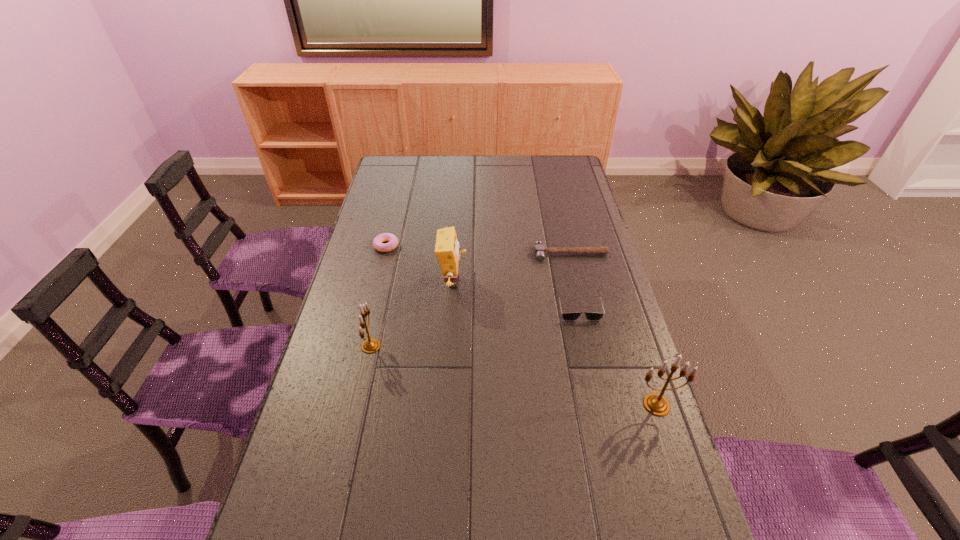
The image size is (960, 540). Find the location of `free point between the sponge and the farther candelabrum`. free point between the sponge and the farther candelabrum is located at coordinates (412, 314).

Locate an element on the screen. This screenshot has width=960, height=540. vacant area between the shorter candelabrum and the fourth object from right to left is located at coordinates (412, 314).

In order to click on empty space that is in between the third object from left to right and the sunglasses in this screenshot , I will do `click(516, 295)`.

Select which object appears as the closest to the doughnut. Please provide its 2D coordinates. Your answer should be formatted as a tuple, i.e. [(x, y)], where the tuple contains the x and y coordinates of a point satisfying the conditions above.

[(447, 252)]

Identify the location of the third closest object to the hammer. (392, 240).

You are a GUI agent. You are given a task and a screenshot of the screen. Output one action in this format:
    pyautogui.click(x=<x>, y=<y>)
    Task: Click on the vacant space that satisfies the following two spatial constraints: 1. on the front-facing side of the sunglasses; 2. on the right side of the taller candelabrum
    This screenshot has height=540, width=960.
    Given the screenshot: What is the action you would take?
    pyautogui.click(x=600, y=404)

I want to click on vacant space that satisfies the following two spatial constraints: 1. on the front-facing side of the taller candelabrum; 2. on the left side of the sunglasses, so click(600, 404).

Image resolution: width=960 pixels, height=540 pixels. Find the location of `vacant space that satisfies the following two spatial constraints: 1. on the striking face of the hammer; 2. on the right side of the nearer candelabrum`. vacant space that satisfies the following two spatial constraints: 1. on the striking face of the hammer; 2. on the right side of the nearer candelabrum is located at coordinates (606, 404).

Where is `free space in the image that satisfies the following two spatial constraints: 1. on the striking face of the taller candelabrum; 2. on the left side of the hammer`? The width and height of the screenshot is (960, 540). free space in the image that satisfies the following two spatial constraints: 1. on the striking face of the taller candelabrum; 2. on the left side of the hammer is located at coordinates (606, 404).

The width and height of the screenshot is (960, 540). Find the location of `free spot that satisfies the following two spatial constraints: 1. on the face of the third object from left to right; 2. on the right side of the right candelabrum`. free spot that satisfies the following two spatial constraints: 1. on the face of the third object from left to right; 2. on the right side of the right candelabrum is located at coordinates (445, 404).